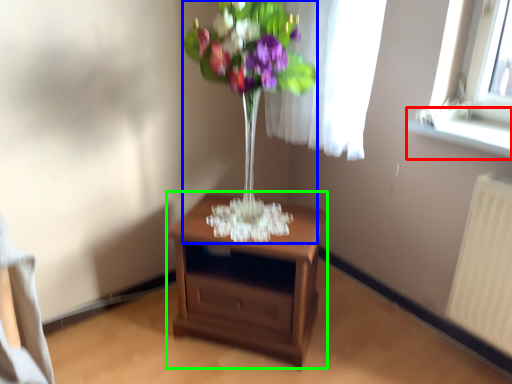
Question: Based on their relative distances, which object is nearer to window sill (highlighted by a red box)? Choose from floral arrangement (highlighted by a blue box) and nightstand (highlighted by a green box).

Choices:
 (A) floral arrangement
 (B) nightstand

Answer: (A)